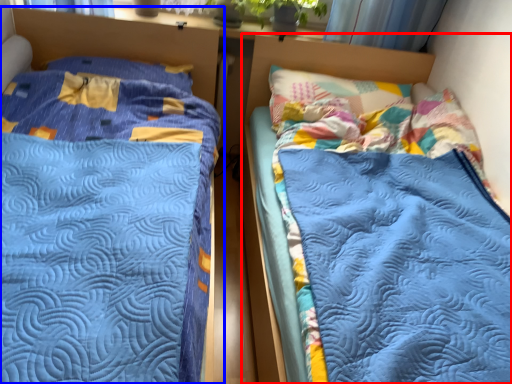
Question: Which of the following is the closest to the observer, bed (highlighted by a red box) or bed (highlighted by a blue box)?

Choices:
 (A) bed
 (B) bed

Answer: (B)